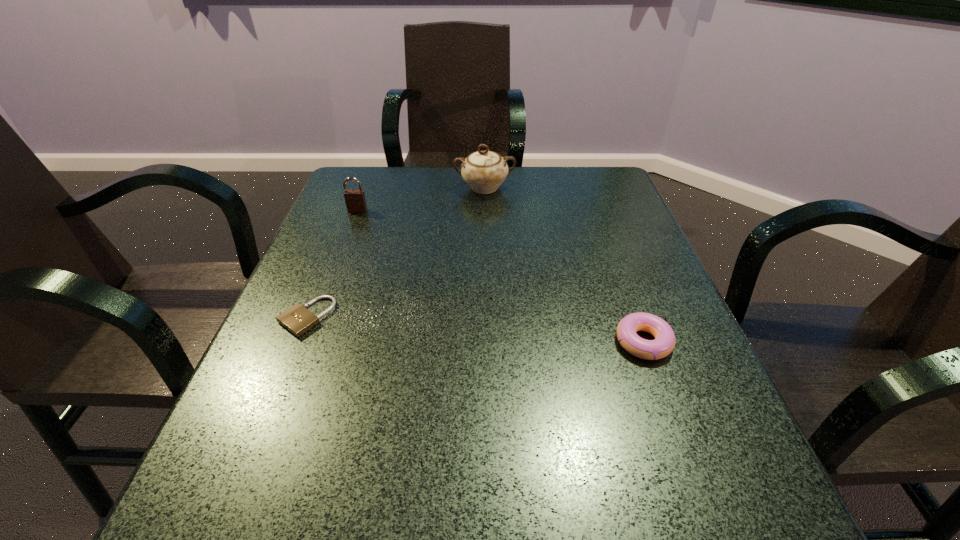
Where is `vacant space at the far left corner`? vacant space at the far left corner is located at coordinates (353, 166).

Locate an element on the screen. vacant area at the far right corner of the desktop is located at coordinates (587, 173).

You are a GUI agent. You are given a task and a screenshot of the screen. Output one action in this format:
    pyautogui.click(x=<x>, y=<y>)
    Task: Click on the vacant area that lies between the farthest object and the second shortest object
    
    Given the screenshot: What is the action you would take?
    pyautogui.click(x=564, y=265)

This screenshot has width=960, height=540. Find the location of `empty space between the farther padlock and the doughnut`. empty space between the farther padlock and the doughnut is located at coordinates (500, 276).

This screenshot has width=960, height=540. What are the coordinates of `unoccupied position between the farthest object and the doughnut` in the screenshot? It's located at (564, 265).

This screenshot has width=960, height=540. In order to click on free space between the doughnut and the shorter padlock in this screenshot , I will do `click(475, 329)`.

Find the location of a particular element. vacant area that lies between the third shortest object and the tallest object is located at coordinates (420, 199).

Identify the location of unoccupied area between the rightmost object and the farthest object. Image resolution: width=960 pixels, height=540 pixels. (564, 265).

Where is `free space between the second tallest object and the chinaware`? The image size is (960, 540). free space between the second tallest object and the chinaware is located at coordinates (420, 199).

You are a GUI agent. You are given a task and a screenshot of the screen. Output one action in this format:
    pyautogui.click(x=<x>, y=<y>)
    Task: Click on the vacant region between the tallest object and the doughnut
    The height and width of the screenshot is (540, 960).
    Given the screenshot: What is the action you would take?
    tap(564, 265)